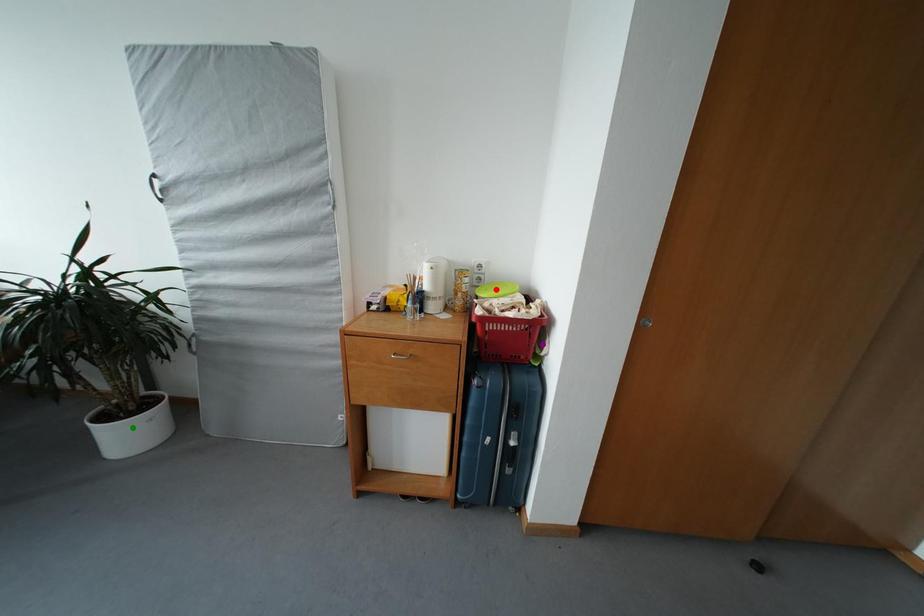
Order these from nearest to farthest:
red point
purple point
green point

purple point < red point < green point